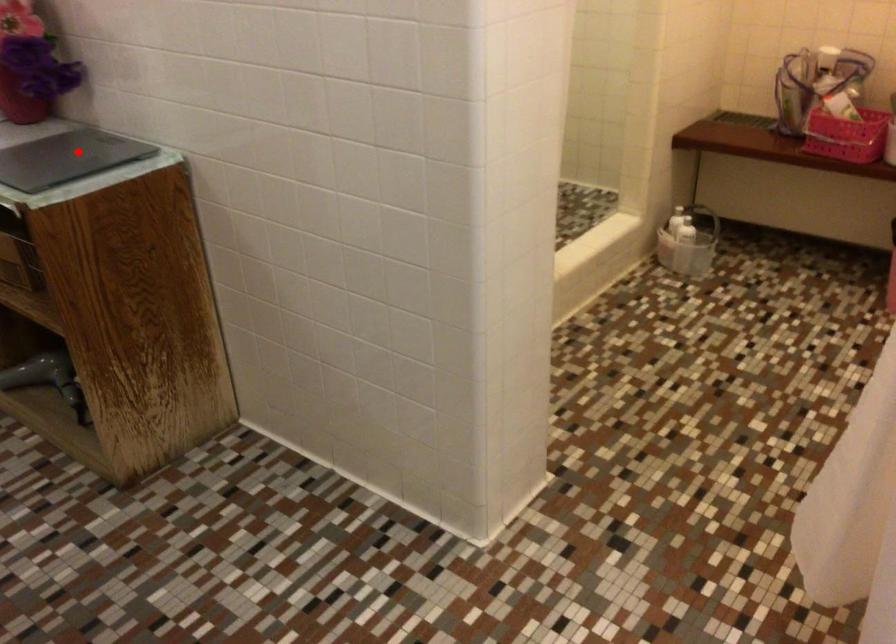
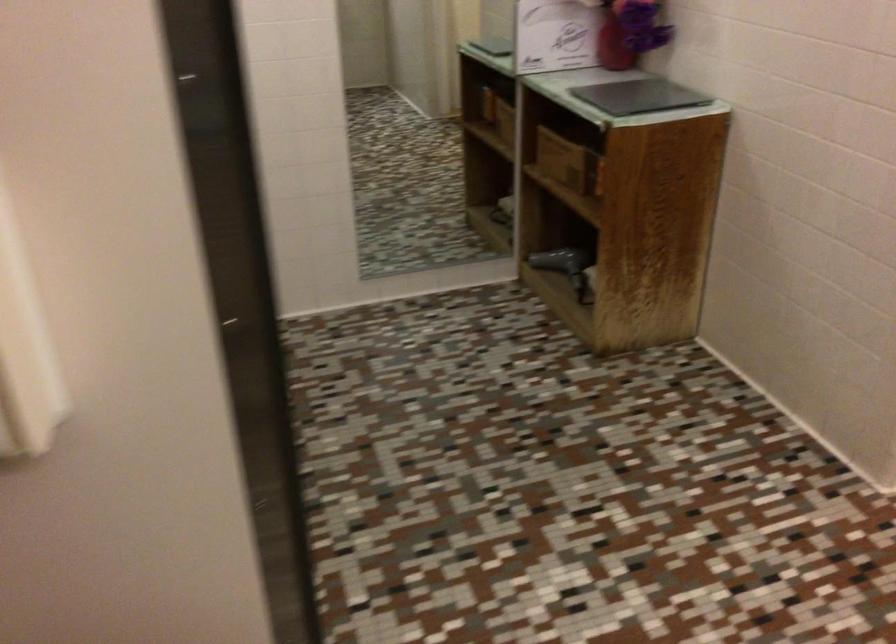
Find the pixel in the second image that matches the highlighted location in the first image.

(639, 96)